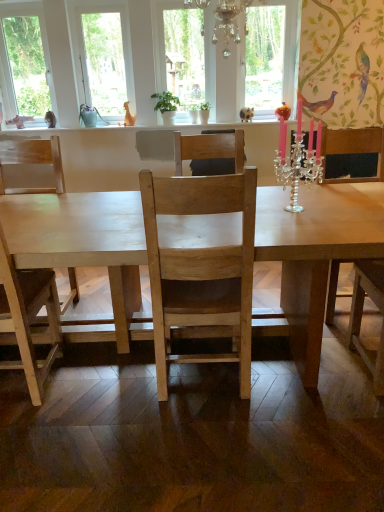
What is the approximate height of white wood frame at upper left, the second window frame viewed from the right?

It is 37.95 inches.

Measure the distance between point (109, 118) and camera.

They are 12.16 feet apart.

Where is `natural wood chair at center, the 1th chair in the right-to-left sequence`? The image size is (384, 512). natural wood chair at center, the 1th chair in the right-to-left sequence is located at coordinates (210, 149).

Measure the distance between point (184, 150) and camera.

Point (184, 150) is 8.56 feet from camera.

Where is `light wood table at center`? This screenshot has height=512, width=384. light wood table at center is located at coordinates click(x=313, y=256).

Consider the image. Measure the distance between point (123,289) and camera.

A distance of 7.37 feet exists between point (123,289) and camera.

Where is `clear glass window at upper left, the second window viewed from the right`? Image resolution: width=384 pixels, height=512 pixels. clear glass window at upper left, the second window viewed from the right is located at coordinates (26, 62).

Measure the distance between clear glass window at upper left, marked as the 1th window in a left-to-right arrangement, and camera.

A distance of 12.09 feet exists between clear glass window at upper left, marked as the 1th window in a left-to-right arrangement, and camera.

What is the approximate height of silver/crystal candle holder at upper right?

silver/crystal candle holder at upper right is 52.92 centimeters tall.

What are the coordinates of `silver/crystal candle holder at upper right` in the screenshot? It's located at (300, 165).

What are the coordinates of `natural wood chair at left, marked as the second chair in a right-to-left arrangement` in the screenshot? It's located at (32, 162).

Considering the relative sizes of clear glass window at upper left, the second window viewed from the right, and transparent glass window at upper right, arranged as the first window when viewed from the right, in the image provided, is clear glass window at upper left, the second window viewed from the right, smaller than transparent glass window at upper right, arranged as the first window when viewed from the right,?

Incorrect, clear glass window at upper left, the second window viewed from the right, is not smaller in size than transparent glass window at upper right, arranged as the first window when viewed from the right.

Which point is more forward, (x=34, y=3) or (x=272, y=51)?

The point (x=34, y=3) is closer to the camera.

How far apart are clear glass window at upper left, marked as the 1th window in a left-to-right arrangement, and transparent glass window at upper right, which ranks as the second window in left-to-right order?

clear glass window at upper left, marked as the 1th window in a left-to-right arrangement, is 8.23 feet away from transparent glass window at upper right, which ranks as the second window in left-to-right order.

Would you consider clear glass window at upper left, the second window viewed from the right, to be distant from transparent glass window at upper right, which ranks as the second window in left-to-right order?

Yes, clear glass window at upper left, the second window viewed from the right, and transparent glass window at upper right, which ranks as the second window in left-to-right order, are located far from each other.

Can you confirm if clear glass window at center, which ranks as the 2th window frame in left-to-right order, is thinner than transparent glass window at upper right, which ranks as the second window in left-to-right order?

Yes.

Is the surface of clear glass window at center, which ranks as the 2th window frame in left-to-right order, in direct contact with transparent glass window at upper right, which ranks as the second window in left-to-right order?

There is a gap between clear glass window at center, which ranks as the 2th window frame in left-to-right order, and transparent glass window at upper right, which ranks as the second window in left-to-right order.

Can you confirm if clear glass window at center, which ranks as the 2th window frame in left-to-right order, is positioned to the right of transparent glass window at upper right, arranged as the first window when viewed from the right?

In fact, clear glass window at center, which ranks as the 2th window frame in left-to-right order, is to the left of transparent glass window at upper right, arranged as the first window when viewed from the right.

What's the angular difference between clear glass window at center, which ranks as the 2th window frame in left-to-right order, and transparent glass window at upper right, which ranks as the second window in left-to-right order,'s facing directions?

clear glass window at center, which ranks as the 2th window frame in left-to-right order, and transparent glass window at upper right, which ranks as the second window in left-to-right order, are facing 0.00132 degrees away from each other.

Does white wood frame at upper left, the second window frame viewed from the right, have a larger size compared to clear glass window at center, which ranks as the 2th window frame in left-to-right order?

Yes, white wood frame at upper left, the second window frame viewed from the right, is bigger than clear glass window at center, which ranks as the 2th window frame in left-to-right order.

Does white wood frame at upper left, which is counted as the first window frame, starting from the left, have a greater height compared to clear glass window at center, the 1th window frame viewed from the right?

Correct, white wood frame at upper left, which is counted as the first window frame, starting from the left, is much taller as clear glass window at center, the 1th window frame viewed from the right.

From a real-world perspective, is white wood frame at upper left, the second window frame viewed from the right, positioned above or below clear glass window at center, which ranks as the 2th window frame in left-to-right order?

white wood frame at upper left, the second window frame viewed from the right, is situated higher than clear glass window at center, which ranks as the 2th window frame in left-to-right order, in the real world.

Where is `window frame below the clear glass window at center, which ranks as the 2th window frame in left-to-right order (from the image's perspective)`? window frame below the clear glass window at center, which ranks as the 2th window frame in left-to-right order (from the image's perspective) is located at coordinates (105, 58).

Is point (281, 286) in front of point (153, 30)?

Yes, point (281, 286) is in front of point (153, 30).

Considering the sizes of objects light wood table at center and clear glass window at center, the 1th window frame viewed from the right, in the image provided, who is bigger, light wood table at center or clear glass window at center, the 1th window frame viewed from the right,?

light wood table at center.

From a real-world perspective, between light wood table at center and clear glass window at center, the 1th window frame viewed from the right, who is vertically higher?

clear glass window at center, the 1th window frame viewed from the right.

From the image's perspective, does light wood table at center appear higher than clear glass window at center, the 1th window frame viewed from the right?

Actually, light wood table at center appears below clear glass window at center, the 1th window frame viewed from the right, in the image.

Find the location of a particular element. Image resolution: width=384 pixels, height=512 pixels. candle holder lying in front of the clear glass window at upper left, the second window viewed from the right is located at coordinates (300, 165).

Is clear glass window at upper left, marked as the 1th window in a left-to-right arrangement, looking in the opposite direction of silver/crystal candle holder at upper right?

No, clear glass window at upper left, marked as the 1th window in a left-to-right arrangement, is not facing the opposite direction of silver/crystal candle holder at upper right.

Is the position of clear glass window at upper left, marked as the 1th window in a left-to-right arrangement, more distant than that of silver/crystal candle holder at upper right?

Yes, clear glass window at upper left, marked as the 1th window in a left-to-right arrangement, is further from the viewer.

Between point (42, 16) and point (292, 185), which one is positioned in front?

Point (292, 185)

From a real-world perspective, which is physically below, natural wood chair at left, the first chair when ordered from left to right, or white wood frame at upper left, the second window frame viewed from the right?

natural wood chair at left, the first chair when ordered from left to right.

Would you consider natural wood chair at left, marked as the second chair in a right-to-left arrangement, to be distant from white wood frame at upper left, the second window frame viewed from the right?

Indeed, natural wood chair at left, marked as the second chair in a right-to-left arrangement, is not near white wood frame at upper left, the second window frame viewed from the right.

Does light wood table at center appear on the left side of wooden chair at right?

Correct, you'll find light wood table at center to the left of wooden chair at right.

Looking at this image, is light wood table at center next to wooden chair at right and touching it?

No, light wood table at center is not in contact with wooden chair at right.

From their relative heights in the image, would you say light wood table at center is taller or shorter than wooden chair at right?

In the image, light wood table at center appears to be shorter than wooden chair at right.

Considering the relative sizes of light wood table at center and wooden chair at right in the image provided, is light wood table at center bigger than wooden chair at right?

Yes, light wood table at center is bigger than wooden chair at right.

At what (x,y) coordinates should I click in order to perform the action: click on window that is in front of the clear glass window at upper left, marked as the 1th window in a left-to-right arrangement. Please return your answer as a coordinate pair (x, y). The width and height of the screenshot is (384, 512). Looking at the image, I should click on coord(264,58).

Find the location of a particular element. window frame that is the 1st one when counting leftward from the transparent glass window at upper right, arranged as the first window when viewed from the right is located at coordinates (160, 36).

When comparing their distances from wooden chair at right, does green matte plant at center or clear glass window at center, the 1th window frame viewed from the right, seem closer?

Among the two, green matte plant at center is located nearer to wooden chair at right.

Based on their spatial positions, is silver/crystal candle holder at upper right or natural wood chair at center, the 1th chair in the right-to-left sequence, closer to transparent glass window at upper right, which ranks as the second window in left-to-right order?

Based on the image, natural wood chair at center, the 1th chair in the right-to-left sequence, appears to be nearer to transparent glass window at upper right, which ranks as the second window in left-to-right order.

When comparing their distances from white wood frame at upper left, which is counted as the first window frame, starting from the left, does natural wood chair at left, the first chair when ordered from left to right, or clear glass window at upper left, marked as the 1th window in a left-to-right arrangement, seem closer?

clear glass window at upper left, marked as the 1th window in a left-to-right arrangement, lies closer to white wood frame at upper left, which is counted as the first window frame, starting from the left, than the other object.

From the picture: Estimate the real-world distances between objects in this image. Which object is further from silver/crystal candle holder at upper right, clear glass window at center, the 1th window frame viewed from the right, or transparent glass window at upper right, arranged as the first window when viewed from the right?

transparent glass window at upper right, arranged as the first window when viewed from the right, is positioned further to the anchor silver/crystal candle holder at upper right.

When comparing their distances from natural wood chair at left, the first chair when ordered from left to right, does silver/crystal candle holder at upper right or light wood table at center seem closer?

The object closer to natural wood chair at left, the first chair when ordered from left to right, is light wood table at center.

Looking at this image, which object lies further to the anchor point clear glass window at center, the 1th window frame viewed from the right, light wood table at center or silver/crystal candle holder at upper right?

The object further to clear glass window at center, the 1th window frame viewed from the right, is light wood table at center.

Looking at the image, which one is located further to light wood table at center, clear glass window at center, which ranks as the 2th window frame in left-to-right order, or wooden chair at right?

The object further to light wood table at center is clear glass window at center, which ranks as the 2th window frame in left-to-right order.

From the image, which object appears to be farther from transparent glass window at upper right, arranged as the first window when viewed from the right, silver/crystal candle holder at upper right or clear glass window at center, which ranks as the 2th window frame in left-to-right order?

Based on the image, silver/crystal candle holder at upper right appears to be further to transparent glass window at upper right, arranged as the first window when viewed from the right.

Where is `houseplant located between clear glass window at upper left, the second window viewed from the right, and natural wood chair at center, which is the second chair in left-to-right order, in the left-right direction`? This screenshot has width=384, height=512. houseplant located between clear glass window at upper left, the second window viewed from the right, and natural wood chair at center, which is the second chair in left-to-right order, in the left-right direction is located at coordinates (166, 106).

Image resolution: width=384 pixels, height=512 pixels. What are the coordinates of `chair between clear glass window at upper left, marked as the 1th window in a left-to-right arrangement, and natural wood chair at center, which is the second chair in left-to-right order, from left to right` in the screenshot? It's located at (32, 162).

The height and width of the screenshot is (512, 384). What are the coordinates of `houseplant between clear glass window at upper left, marked as the 1th window in a left-to-right arrangement, and transparent glass window at upper right, arranged as the first window when viewed from the right` in the screenshot? It's located at (166, 106).

The image size is (384, 512). I want to click on armchair between clear glass window at center, the 1th window frame viewed from the right, and light wood table at center in the up-down direction, so click(354, 149).